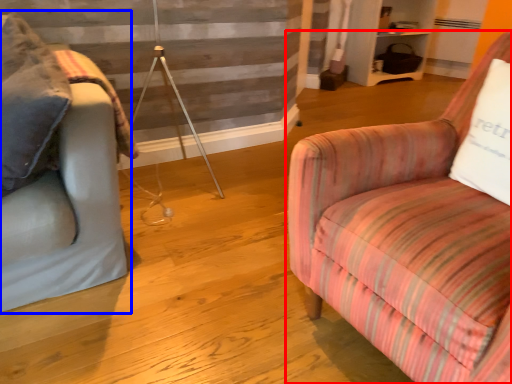
Question: Which point is closer to the camera, chair (highlighted by a red box) or studio couch (highlighted by a blue box)?

Choices:
 (A) chair
 (B) studio couch

Answer: (A)